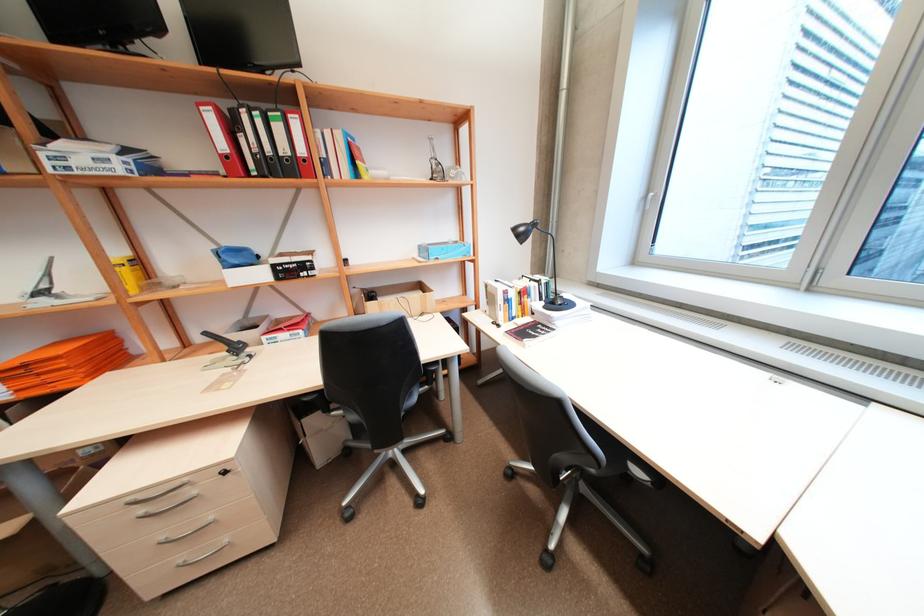
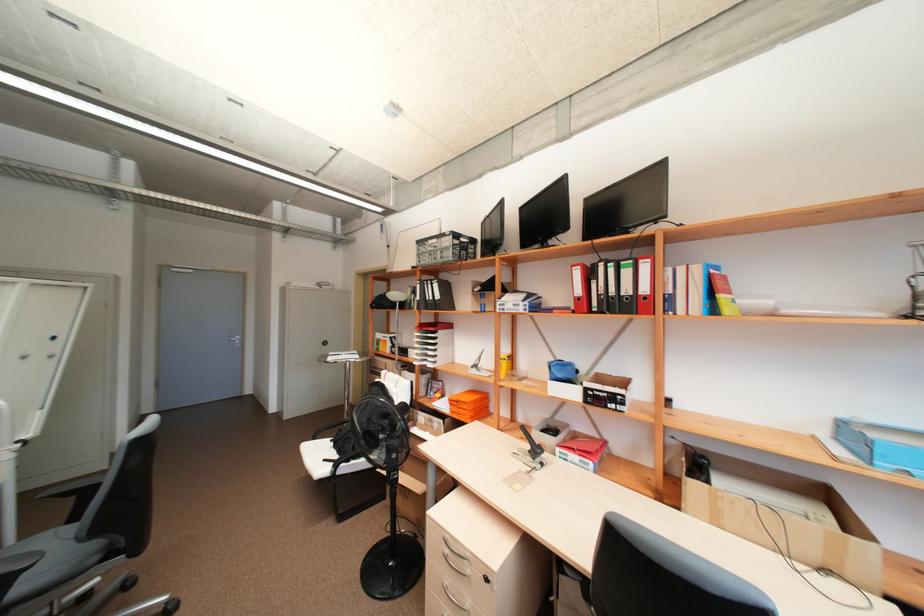
Locate, in the second image, the point that corresponds to point (228, 146) in the first image.

(584, 291)